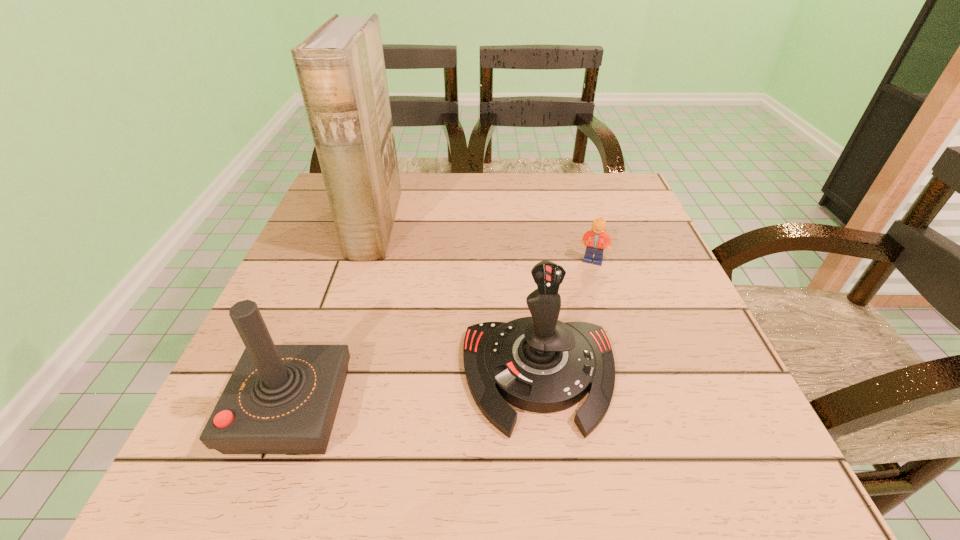
Locate an element on the screen. This screenshot has width=960, height=540. joystick that is positioned at the left edge is located at coordinates (280, 399).

This screenshot has width=960, height=540. In order to click on object located in the right edge section of the desktop in this screenshot , I will do `click(597, 238)`.

Where is `object at the far left corner`? object at the far left corner is located at coordinates pyautogui.click(x=340, y=67).

At what (x,y) coordinates should I click in order to perform the action: click on object located at the near left corner. Please return your answer as a coordinate pair (x, y). This screenshot has height=540, width=960. Looking at the image, I should click on (280, 399).

In the image, there is a desktop. Identify the location of vacant space at the far edge. (444, 210).

Locate an element on the screen. Image resolution: width=960 pixels, height=540 pixels. free space at the near edge of the desktop is located at coordinates (435, 450).

This screenshot has height=540, width=960. Find the location of `free space at the right edge`. free space at the right edge is located at coordinates (702, 405).

The image size is (960, 540). Identify the location of vacant space at the far right corner of the desktop. (616, 200).

The image size is (960, 540). I want to click on blank area at the near right corner, so click(659, 446).

Where is `vacant area that lies between the tallest object and the Lego`? vacant area that lies between the tallest object and the Lego is located at coordinates point(484,244).